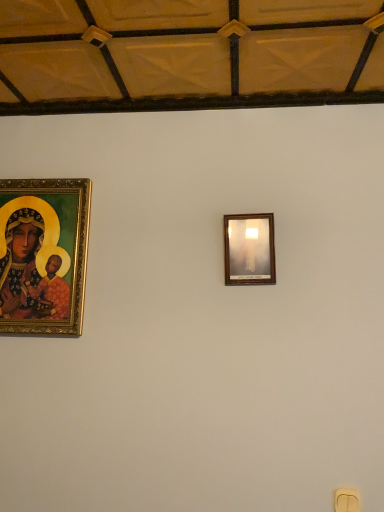
Question: Does gold-framed painting at left come behind yellow plastic light switch at lower right?

Choices:
 (A) yes
 (B) no

Answer: (A)

Question: Considering the relative sizes of gold-framed painting at left and yellow plastic light switch at lower right in the image provided, is gold-framed painting at left taller than yellow plastic light switch at lower right?

Choices:
 (A) yes
 (B) no

Answer: (A)

Question: Can you confirm if gold-framed painting at left is positioned to the right of yellow plastic light switch at lower right?

Choices:
 (A) yes
 (B) no

Answer: (B)

Question: From a real-world perspective, is gold-framed painting at left physically above yellow plastic light switch at lower right?

Choices:
 (A) no
 (B) yes

Answer: (B)

Question: Would you say gold-framed painting at left contains yellow plastic light switch at lower right?

Choices:
 (A) no
 (B) yes

Answer: (A)

Question: Is gold-framed painting at left shorter than yellow plastic light switch at lower right?

Choices:
 (A) no
 (B) yes

Answer: (A)

Question: Does yellow plastic light switch at lower right have a greater height compared to gold-framed painting at left?

Choices:
 (A) yes
 (B) no

Answer: (B)

Question: From a real-world perspective, is yellow plastic light switch at lower right under gold-framed painting at left?

Choices:
 (A) yes
 (B) no

Answer: (A)

Question: Is yellow plastic light switch at lower right oriented away from gold-framed painting at left?

Choices:
 (A) yes
 (B) no

Answer: (B)

Question: Is the surface of yellow plastic light switch at lower right in direct contact with gold-framed painting at left?

Choices:
 (A) yes
 (B) no

Answer: (B)

Question: Is yellow plastic light switch at lower right located outside gold-framed painting at left?

Choices:
 (A) no
 (B) yes

Answer: (B)

Question: Is yellow plastic light switch at lower right positioned in front of gold-framed painting at left?

Choices:
 (A) yes
 (B) no

Answer: (A)

Question: Is the depth of gold-framed painting at left greater than that of wooden picture frame at upper center?

Choices:
 (A) yes
 (B) no

Answer: (A)